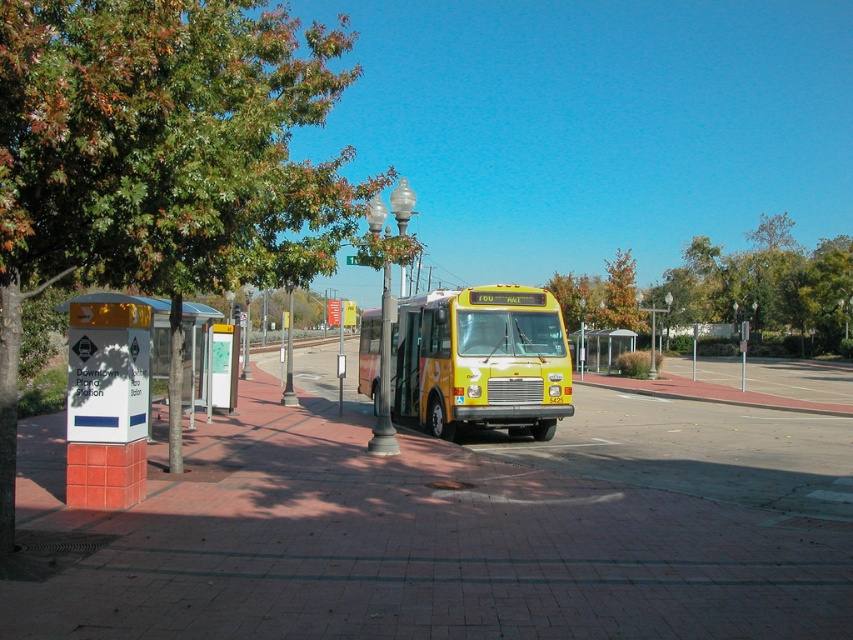
You are standing at the Downtown Plano Station bus shelter and looking towards the yellow and orange bus parked at the stop. There are two points marked on the bus, one at coordinate point [285,17] and another at point [453,342]. Which of these two points is closer to you?

Point [285,17] is closer to the viewer than point [453,342].

You are a pedestrian standing at the Downtown Plano Station bus stop. You notice the brick pavement at center and the green leafy tree at center. Which object is closer to the ground?

The brick pavement at center is below green leafy tree at center, so the brick pavement at center is closer to the ground.

You are a city planner evaluating the bus stop layout. The green leafy tree at upper left and the yellow matte bus at center are both important elements. Considering their sizes, which one takes up more horizontal space in the image?

The green leafy tree at upper left takes up more horizontal space in the image because its width is larger than that of the yellow matte bus at center.